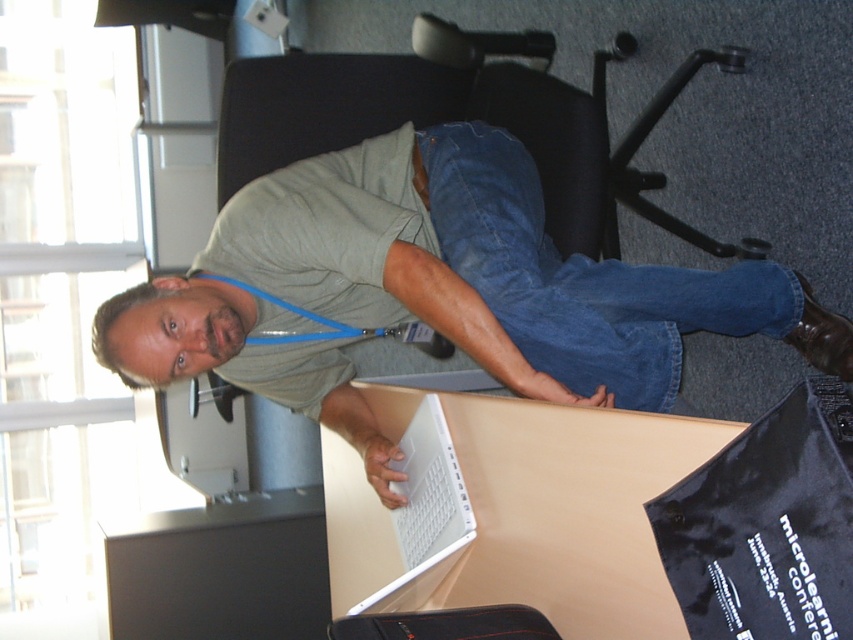
You are standing in front of the desk and want to place a small item on the desk. You have two options to choose from. The first option is to place it at point A, which is at coordinates point [517,51]. The second option is to place it at point B, which is at coordinates point [463,522]. Which point is closer to you?

Point A, which is at coordinates point [517,51], is closer to you because it is further to the camera than point B, which is further away.

You are standing in front of the desk and want to place a small object on the desk. You have two points to choose from. The first point is at coordinate point [653,285] and the second is at point [486,161]. Which point is closer to you?

Point [653,285] is closer to the camera than point [486,161], so you should choose the first point.